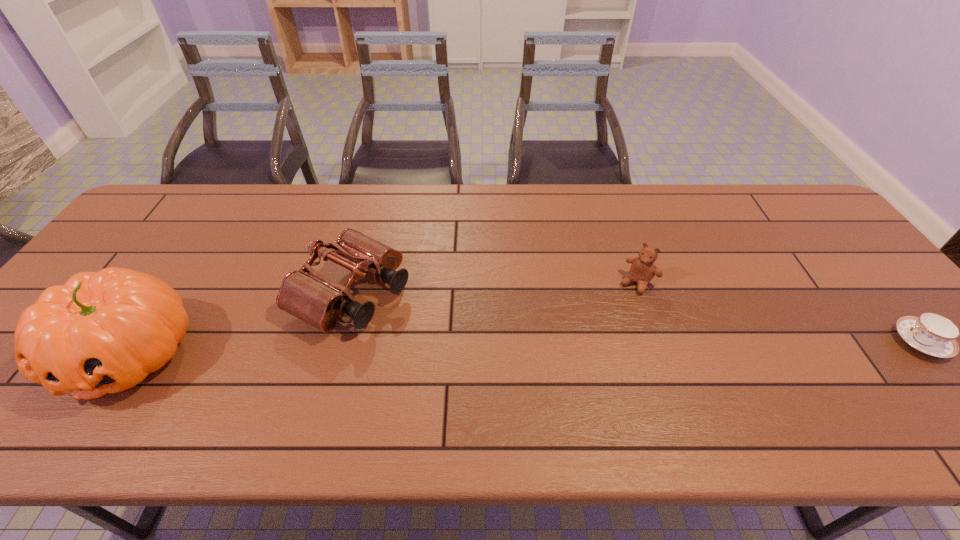
Find the location of a particular element. This screenshot has height=540, width=960. vacant space on the desktop that is between the pumpkin and the shortest object and is positioned on the face of the teddy bear is located at coordinates (590, 346).

You are a GUI agent. You are given a task and a screenshot of the screen. Output one action in this format:
    pyautogui.click(x=<x>, y=<y>)
    Task: Click on the vacant space on the desktop that is between the pumpkin and the shortest object and is positioned through the eyepieces of the second object from left to right
    This screenshot has width=960, height=540.
    Given the screenshot: What is the action you would take?
    pyautogui.click(x=457, y=348)